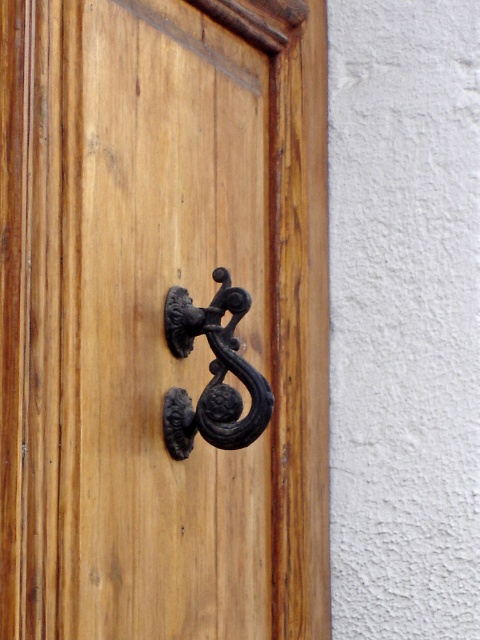
Question: Can you confirm if matte black knocker at center is positioned to the right of black wrought iron door handle at center?

Choices:
 (A) no
 (B) yes

Answer: (B)

Question: From the image, what is the correct spatial relationship of matte black knocker at center in relation to black wrought iron door handle at center?

Choices:
 (A) right
 (B) left

Answer: (A)

Question: Is matte black knocker at center positioned before black wrought iron door handle at center?

Choices:
 (A) yes
 (B) no

Answer: (A)

Question: Which point is farther to the camera?

Choices:
 (A) (90, 484)
 (B) (229, 362)

Answer: (B)